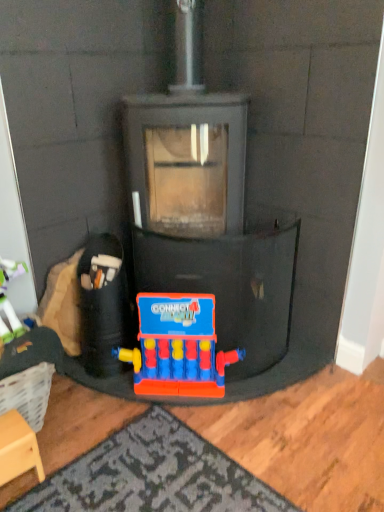
The image size is (384, 512). Describe the element at coordinates (178, 347) in the screenshot. I see `plastic connect four game at center, the 1th toy when ordered from right to left` at that location.

Locate an element on the screen. rubberized plastic toy at lower center, the second toy from the right is located at coordinates (102, 304).

Locate an element on the screen. The height and width of the screenshot is (512, 384). plastic connect four game at center, the 1th toy when ordered from right to left is located at coordinates (178, 347).

Considering the relative sizes of wooden stool at lower left and plastic connect four game at center, the 2th toy when ordered from left to right, in the image provided, is wooden stool at lower left wider than plastic connect four game at center, the 2th toy when ordered from left to right,?

Correct, the width of wooden stool at lower left exceeds that of plastic connect four game at center, the 2th toy when ordered from left to right.

Can we say wooden stool at lower left lies outside plastic connect four game at center, the 2th toy when ordered from left to right?

Yes, wooden stool at lower left is located beyond the bounds of plastic connect four game at center, the 2th toy when ordered from left to right.

Is the surface of wooden stool at lower left in direct contact with plastic connect four game at center, the 2th toy when ordered from left to right?

No.

In the scene shown: Can you confirm if plastic connect four game at center, the 1th toy when ordered from right to left, is shorter than rubberized plastic toy at lower center, acting as the first toy starting from the left?

Correct, plastic connect four game at center, the 1th toy when ordered from right to left, is not as tall as rubberized plastic toy at lower center, acting as the first toy starting from the left.

Between plastic connect four game at center, the 1th toy when ordered from right to left, and rubberized plastic toy at lower center, acting as the first toy starting from the left, which one has larger width?

With larger width is rubberized plastic toy at lower center, acting as the first toy starting from the left.

Is plastic connect four game at center, the 2th toy when ordered from left to right, bigger or smaller than rubberized plastic toy at lower center, acting as the first toy starting from the left?

In the image, plastic connect four game at center, the 2th toy when ordered from left to right, appears to be smaller than rubberized plastic toy at lower center, acting as the first toy starting from the left.

Considering the points (157, 387) and (17, 471), which point is in front, point (157, 387) or point (17, 471)?

The point (17, 471) is more forward.

How far apart are plastic connect four game at center, the 1th toy when ordered from right to left, and wooden stool at lower left?

A distance of 21.87 inches exists between plastic connect four game at center, the 1th toy when ordered from right to left, and wooden stool at lower left.

Is wooden stool at lower left surrounded by plastic connect four game at center, the 1th toy when ordered from right to left?

No, wooden stool at lower left is not inside plastic connect four game at center, the 1th toy when ordered from right to left.

Relative to wooden stool at lower left, is plastic connect four game at center, the 1th toy when ordered from right to left, in front or behind?

Visually, plastic connect four game at center, the 1th toy when ordered from right to left, is located behind wooden stool at lower left.

Is wooden stool at lower left in front of or behind rubberized plastic toy at lower center, the second toy from the right, in the image?

Visually, wooden stool at lower left is located in front of rubberized plastic toy at lower center, the second toy from the right.

Consider the image. Can you tell me how much wooden stool at lower left and rubberized plastic toy at lower center, the second toy from the right, differ in facing direction?

0.627 degrees separate the facing orientations of wooden stool at lower left and rubberized plastic toy at lower center, the second toy from the right.

Is wooden stool at lower left far from rubberized plastic toy at lower center, acting as the first toy starting from the left?

→ That's not correct — wooden stool at lower left is a little close to rubberized plastic toy at lower center, acting as the first toy starting from the left.

Can you confirm if wooden stool at lower left is shorter than rubberized plastic toy at lower center, the second toy from the right?

Correct, wooden stool at lower left is not as tall as rubberized plastic toy at lower center, the second toy from the right.

Does rubberized plastic toy at lower center, the second toy from the right, have a greater width compared to plastic connect four game at center, the 2th toy when ordered from left to right?

Correct, the width of rubberized plastic toy at lower center, the second toy from the right, exceeds that of plastic connect four game at center, the 2th toy when ordered from left to right.

In the scene shown: From the image's perspective, which one is positioned higher, rubberized plastic toy at lower center, acting as the first toy starting from the left, or plastic connect four game at center, the 2th toy when ordered from left to right?

rubberized plastic toy at lower center, acting as the first toy starting from the left, from the image's perspective.

Can you confirm if rubberized plastic toy at lower center, acting as the first toy starting from the left, is positioned to the left of plastic connect four game at center, the 2th toy when ordered from left to right?

Yes, rubberized plastic toy at lower center, acting as the first toy starting from the left, is to the left of plastic connect four game at center, the 2th toy when ordered from left to right.

Considering the positions of objects rubberized plastic toy at lower center, the second toy from the right, and wooden stool at lower left in the image provided, who is more to the right, rubberized plastic toy at lower center, the second toy from the right, or wooden stool at lower left?

rubberized plastic toy at lower center, the second toy from the right, is more to the right.

Is rubberized plastic toy at lower center, the second toy from the right, surrounding wooden stool at lower left?

No.

From the image's perspective, which object appears higher, rubberized plastic toy at lower center, acting as the first toy starting from the left, or wooden stool at lower left?

From the image's view, rubberized plastic toy at lower center, acting as the first toy starting from the left, is above.

Considering the points (108, 290) and (16, 472), which point is behind, point (108, 290) or point (16, 472)?

The point (108, 290) is behind.

This screenshot has height=512, width=384. What are the coordinates of `furniture located below the plastic connect four game at center, the 1th toy when ordered from right to left (from the image's perspective)` in the screenshot? It's located at (18, 448).

Identify the location of toy behind the plastic connect four game at center, the 2th toy when ordered from left to right. (102, 304).

Which object lies nearer to the anchor point wooden stool at lower left, plastic connect four game at center, the 2th toy when ordered from left to right, or rubberized plastic toy at lower center, the second toy from the right?

rubberized plastic toy at lower center, the second toy from the right, is positioned closer to the anchor wooden stool at lower left.

Which object lies further to the anchor point plastic connect four game at center, the 1th toy when ordered from right to left, wooden stool at lower left or rubberized plastic toy at lower center, the second toy from the right?

wooden stool at lower left lies further to plastic connect four game at center, the 1th toy when ordered from right to left, than the other object.

Considering their positions, is rubberized plastic toy at lower center, acting as the first toy starting from the left, positioned closer to wooden stool at lower left than plastic connect four game at center, the 1th toy when ordered from right to left?

Based on the image, rubberized plastic toy at lower center, acting as the first toy starting from the left, appears to be nearer to wooden stool at lower left.

From the image, which object appears to be nearer to rubberized plastic toy at lower center, acting as the first toy starting from the left, plastic connect four game at center, the 1th toy when ordered from right to left, or wooden stool at lower left?

plastic connect four game at center, the 1th toy when ordered from right to left, lies closer to rubberized plastic toy at lower center, acting as the first toy starting from the left, than the other object.

Looking at the image, which one is located further to rubberized plastic toy at lower center, the second toy from the right, wooden stool at lower left or plastic connect four game at center, the 1th toy when ordered from right to left?

wooden stool at lower left is positioned further to the anchor rubberized plastic toy at lower center, the second toy from the right.

When comparing their distances from plastic connect four game at center, the 2th toy when ordered from left to right, does rubberized plastic toy at lower center, acting as the first toy starting from the left, or wooden stool at lower left seem further?

wooden stool at lower left is further to plastic connect four game at center, the 2th toy when ordered from left to right.

Image resolution: width=384 pixels, height=512 pixels. In order to click on toy between wooden stool at lower left and plastic connect four game at center, the 1th toy when ordered from right to left, in the horizontal direction in this screenshot , I will do `click(102, 304)`.